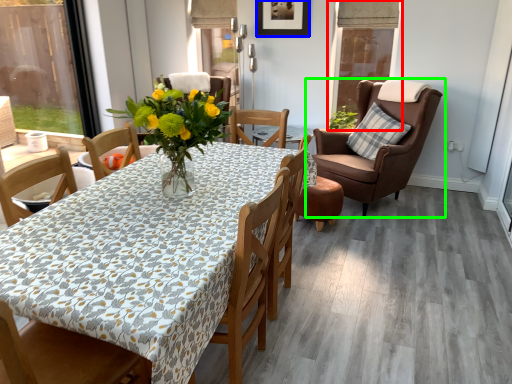
Question: Based on their relative distances, which object is farther from window screen (highlighted by a red box)? Choose from picture frame (highlighted by a blue box) and chair (highlighted by a green box).

Choices:
 (A) picture frame
 (B) chair

Answer: (A)